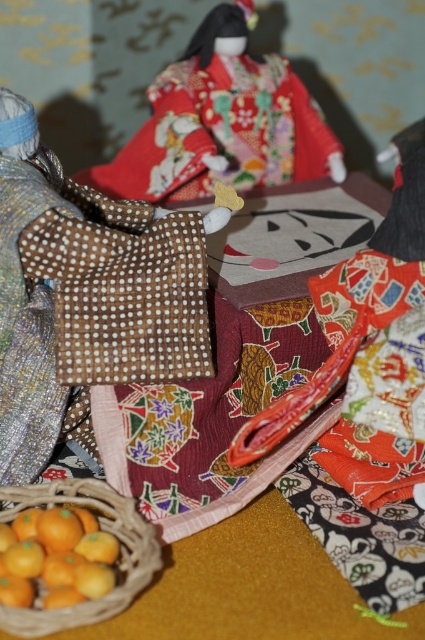
You are organizing a Hina Matsuri display and need to place both the brown dotted fabric bag at center and the brown woven basket at lower left. Which object has a greater width?

The brown dotted fabric bag at center has a greater width than the brown woven basket at lower left.

You are preparing to place a decorative item in either the brown dotted fabric bag at center or the brown woven basket at lower left for a display. Which container has a bigger capacity to hold more items?

The brown dotted fabric bag at center is larger in size than the brown woven basket at lower left, so it has a bigger capacity to hold more items.

You are a child trying to reach the yellow matte oranges at lower left inside the brown woven basket at lower left. Can you see the top of the oranges from above the basket?

The yellow matte oranges at lower left has a lesser height compared to brown woven basket at lower left, so the top of the yellow matte oranges at lower left is not visible from above the basket.